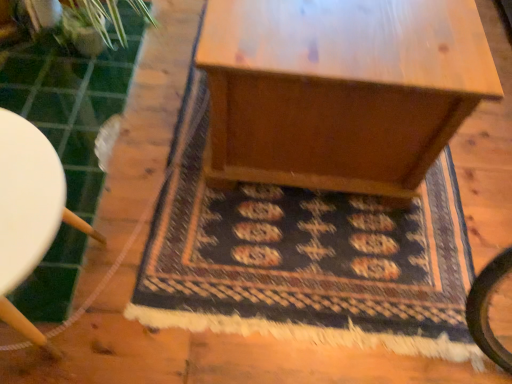
Question: Considering the positions of point (14, 114) and point (312, 102), is point (14, 114) closer or farther from the camera than point (312, 102)?

Choices:
 (A) farther
 (B) closer

Answer: (B)

Question: Relative to wooden table at center, is white plastic stool at left in front or behind?

Choices:
 (A) behind
 (B) front

Answer: (B)

Question: Which object is positioned farthest from the white plastic stool at left?

Choices:
 (A) dark blue woven rug at center
 (B) wooden table at center

Answer: (B)

Question: Which of these objects is positioned closest to the dark blue woven rug at center?

Choices:
 (A) white plastic stool at left
 (B) wooden table at center

Answer: (B)